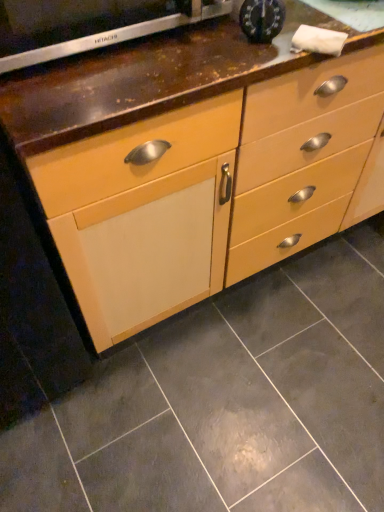
Question: Is metallic clock at upper center, which ranks as the 1th appliance in right-to-left order, at the back of satin silver oven at upper left, acting as the 2th appliance starting from the right?

Choices:
 (A) yes
 (B) no

Answer: (B)

Question: Could you tell me if satin silver oven at upper left, marked as the first appliance in a left-to-right arrangement, is facing metallic clock at upper center, which ranks as the 1th appliance in right-to-left order?

Choices:
 (A) no
 (B) yes

Answer: (B)

Question: From the image's perspective, is satin silver oven at upper left, marked as the first appliance in a left-to-right arrangement, below metallic clock at upper center, which ranks as the 1th appliance in right-to-left order?

Choices:
 (A) yes
 (B) no

Answer: (B)

Question: Can you confirm if satin silver oven at upper left, marked as the first appliance in a left-to-right arrangement, is taller than metallic clock at upper center, acting as the second appliance starting from the left?

Choices:
 (A) yes
 (B) no

Answer: (A)

Question: From the image's perspective, is satin silver oven at upper left, marked as the first appliance in a left-to-right arrangement, on metallic clock at upper center, which ranks as the 1th appliance in right-to-left order?

Choices:
 (A) no
 (B) yes

Answer: (B)

Question: Can you confirm if satin silver oven at upper left, acting as the 2th appliance starting from the right, is shorter than metallic clock at upper center, which ranks as the 1th appliance in right-to-left order?

Choices:
 (A) yes
 (B) no

Answer: (B)

Question: Is satin silver oven at upper left, marked as the first appliance in a left-to-right arrangement, a part of matte wood chest of drawers at center?

Choices:
 (A) yes
 (B) no

Answer: (B)

Question: Is matte wood chest of drawers at center bigger than satin silver oven at upper left, acting as the 2th appliance starting from the right?

Choices:
 (A) yes
 (B) no

Answer: (A)

Question: Is matte wood chest of drawers at center wider than satin silver oven at upper left, acting as the 2th appliance starting from the right?

Choices:
 (A) yes
 (B) no

Answer: (A)

Question: Is matte wood chest of drawers at center shorter than satin silver oven at upper left, acting as the 2th appliance starting from the right?

Choices:
 (A) no
 (B) yes

Answer: (A)

Question: Is matte wood chest of drawers at center not inside satin silver oven at upper left, acting as the 2th appliance starting from the right?

Choices:
 (A) yes
 (B) no

Answer: (A)

Question: Is satin silver oven at upper left, marked as the first appliance in a left-to-right arrangement, at the back of matte wood chest of drawers at center?

Choices:
 (A) yes
 (B) no

Answer: (B)

Question: Can you confirm if matte wood chest of drawers at center is wider than matte gray tile at center?

Choices:
 (A) no
 (B) yes

Answer: (A)